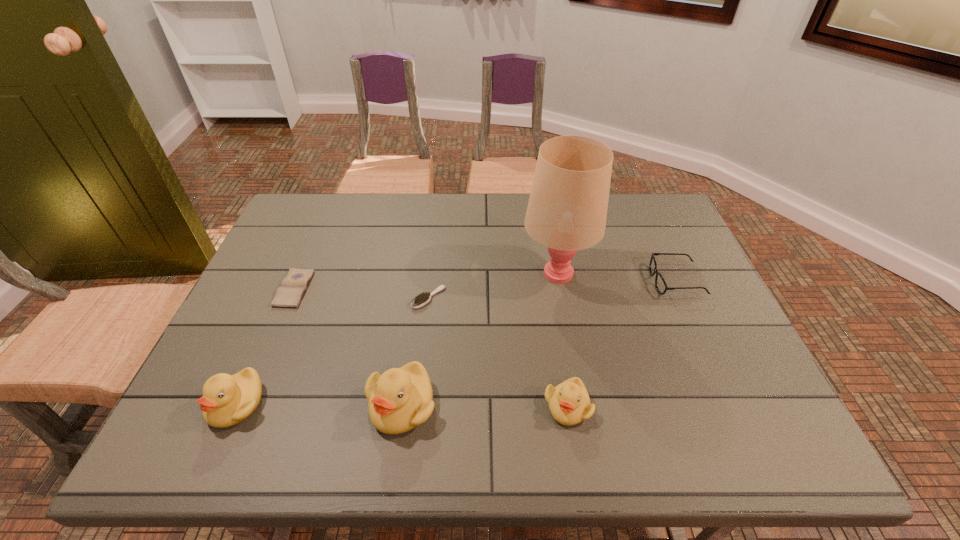
At what (x,y) coordinates should I click in order to perform the action: click on the leftmost duckling. Please return your answer as a coordinate pair (x, y). This screenshot has width=960, height=540. Looking at the image, I should click on (227, 400).

Find the location of a particular element. the second shortest duckling is located at coordinates (227, 400).

Where is `the tallest duckling`? the tallest duckling is located at coordinates 400,399.

This screenshot has width=960, height=540. I want to click on the sixth shortest object, so (400, 399).

This screenshot has height=540, width=960. I want to click on the fourth shortest object, so click(569, 403).

You are a GUI agent. You are given a task and a screenshot of the screen. Output one action in this format:
    pyautogui.click(x=<x>, y=<y>)
    Task: Click on the shortest duckling
    The image size is (960, 540).
    Given the screenshot: What is the action you would take?
    pyautogui.click(x=569, y=403)

The width and height of the screenshot is (960, 540). I want to click on lampshade, so click(x=567, y=209).

Image resolution: width=960 pixels, height=540 pixels. I want to click on diary, so click(x=289, y=294).

The width and height of the screenshot is (960, 540). Find the location of `spectacles`. spectacles is located at coordinates (661, 286).

What are the coordinates of `the fifth tallest object` in the screenshot? It's located at 661,286.